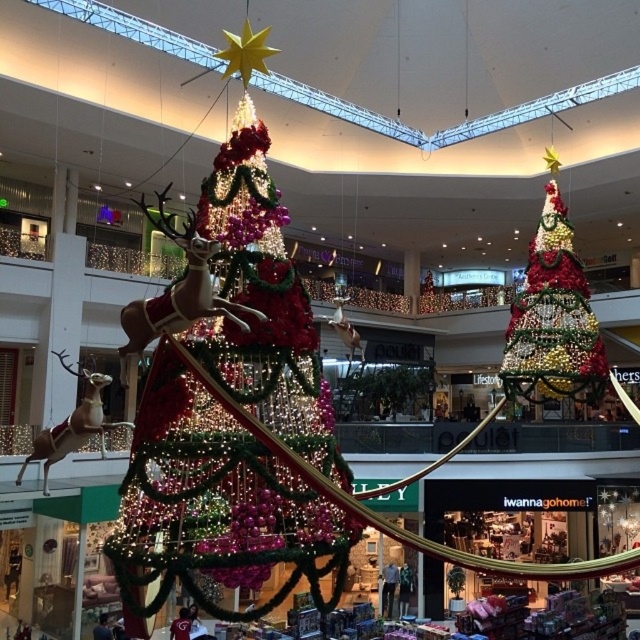
Is iridescent glass christmas tree at center taller than shiny metallic christmas tree at upper right?

Incorrect, iridescent glass christmas tree at center's height is not larger of shiny metallic christmas tree at upper right's.

Between iridescent glass christmas tree at center and shiny metallic christmas tree at upper right, which one has more height?

Standing taller between the two is shiny metallic christmas tree at upper right.

Does point (323, 550) come farther from viewer compared to point (554, 260)?

No.

Where is `iridescent glass christmas tree at center`? iridescent glass christmas tree at center is located at coordinates (228, 397).